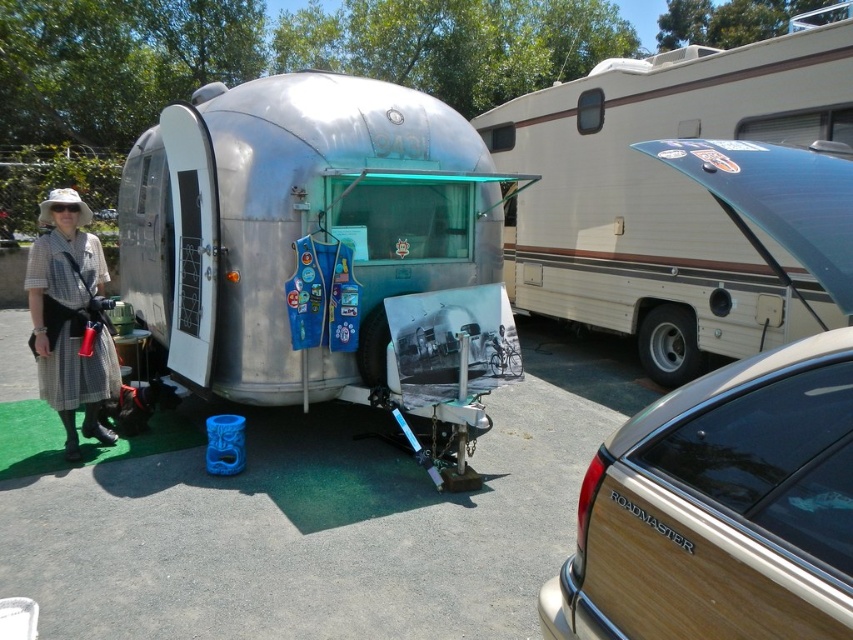
Question: Can you confirm if teal woodgrain roadmaster at right is smaller than checkered fabric dress at lower left?

Choices:
 (A) yes
 (B) no

Answer: (A)

Question: Which point is farther to the camera?

Choices:
 (A) (76, 371)
 (B) (622, 61)
 (C) (730, 371)
 (D) (169, 236)

Answer: (B)

Question: Is shiny aluminum trailer at center to the right of teal woodgrain roadmaster at right from the viewer's perspective?

Choices:
 (A) no
 (B) yes

Answer: (A)

Question: Which point is closer to the camera taking this photo?

Choices:
 (A) (693, 467)
 (B) (537, 128)
 (C) (160, 307)
 (D) (44, 380)

Answer: (A)

Question: Which object is farther from the camera taking this photo?

Choices:
 (A) checkered fabric dress at lower left
 (B) beige vinyl recreational vehicle at upper right

Answer: (B)

Question: Is beige vinyl recreational vehicle at upper right wider than checkered fabric dress at lower left?

Choices:
 (A) no
 (B) yes

Answer: (A)